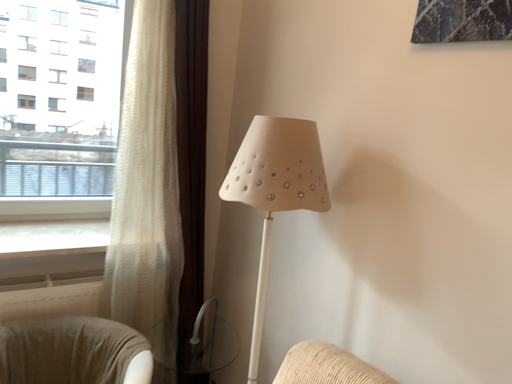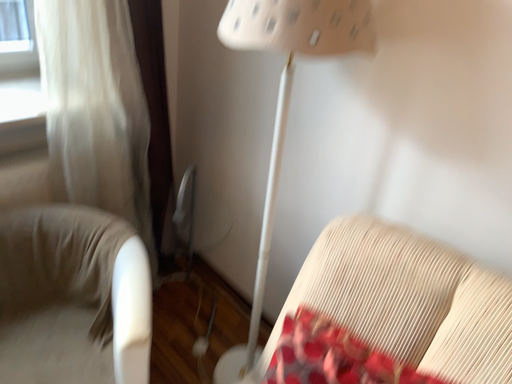
Question: Which way did the camera rotate in the video?

Choices:
 (A) rotated downward
 (B) rotated upward

Answer: (A)